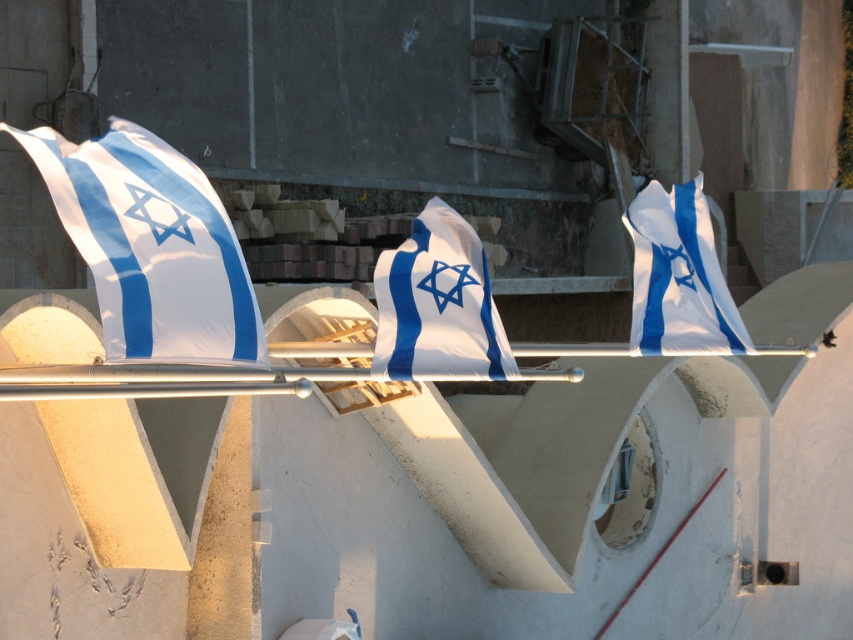
Between white fabric flag at center and white fabric flag at right, which one appears on the left side from the viewer's perspective?

white fabric flag at center is more to the left.

Which is in front, point (448, 276) or point (724, 336)?

Point (448, 276) is more forward.

The image size is (853, 640). I want to click on white fabric flag at center, so click(438, 305).

Can you confirm if white fabric flag at left is positioned to the left of white fabric flag at right?

Indeed, white fabric flag at left is positioned on the left side of white fabric flag at right.

Does white fabric flag at left appear under white fabric flag at right?

Indeed, white fabric flag at left is positioned under white fabric flag at right.

Does point (149, 289) come behind point (651, 225)?

No, it is not.

Find the location of a particular element. The width and height of the screenshot is (853, 640). white fabric flag at left is located at coordinates click(151, 246).

You are a GUI agent. You are given a task and a screenshot of the screen. Output one action in this format:
    pyautogui.click(x=<x>, y=<y>)
    Task: Click on the white fabric flag at left
    The width and height of the screenshot is (853, 640).
    Given the screenshot: What is the action you would take?
    pyautogui.click(x=151, y=246)

Does white fabric flag at left have a larger size compared to white fabric flag at center?

Yes.

I want to click on white fabric flag at left, so click(x=151, y=246).